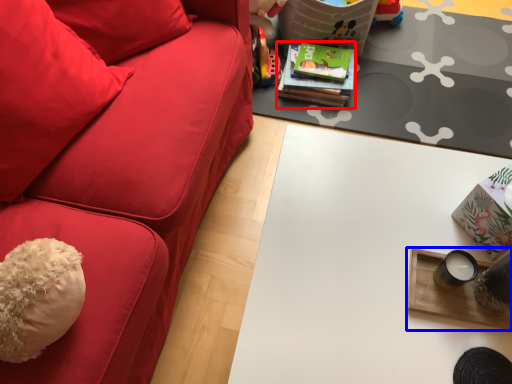
Question: Which of the following is the farthest to the observer, magazine (highlighted by a red box) or table (highlighted by a blue box)?

Choices:
 (A) magazine
 (B) table

Answer: (A)